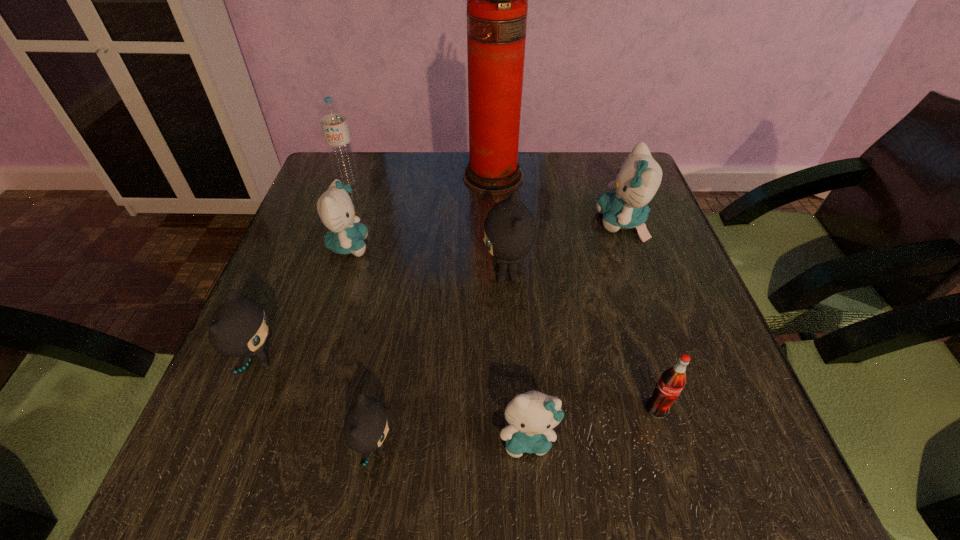
Identify the location of the second closest object relative to the leftmost gray kitten. The height and width of the screenshot is (540, 960). [335, 208].

This screenshot has width=960, height=540. I want to click on kitten that stands as the fifth closest to the rightmost kitten, so click(238, 328).

This screenshot has width=960, height=540. I want to click on kitten object that ranks as the closest to the leftmost kitten, so click(x=365, y=426).

The width and height of the screenshot is (960, 540). I want to click on blue kitten that stands as the closest to the second smallest gray kitten, so click(335, 208).

The width and height of the screenshot is (960, 540). What are the coordinates of `blue kitten that is the closest to the soda bottle` in the screenshot? It's located at (531, 416).

At what (x,y) coordinates should I click in order to perform the action: click on the third closest gray kitten to the smallest blue kitten. Please return your answer as a coordinate pair (x, y). The width and height of the screenshot is (960, 540). Looking at the image, I should click on (238, 328).

Point out which gray kitten is positioned as the second nearest to the fourth farthest kitten. Please provide its 2D coordinates. Your answer should be formatted as a tuple, i.e. [(x, y)], where the tuple contains the x and y coordinates of a point satisfying the conditions above.

[(510, 230)]

This screenshot has height=540, width=960. In order to click on vacant space that satisfies the following two spatial constraints: 1. on the face of the second blue kitten from right to left; 2. on the front-facing side of the smallest gray kitten in this screenshot , I will do `click(529, 447)`.